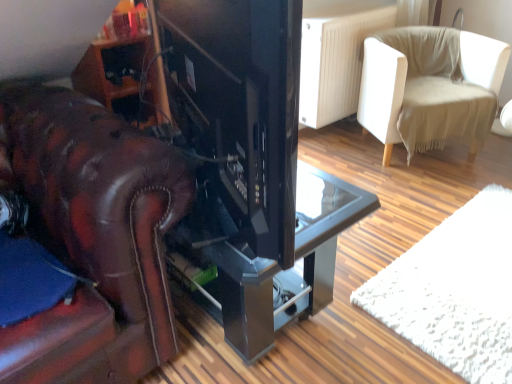
Question: Is matte black tv at center next to glossy black table at center?

Choices:
 (A) yes
 (B) no

Answer: (B)

Question: Can you confirm if matte black tv at center is shorter than glossy black table at center?

Choices:
 (A) no
 (B) yes

Answer: (A)

Question: Can you confirm if matte black tv at center is thinner than glossy black table at center?

Choices:
 (A) no
 (B) yes

Answer: (B)

Question: Is matte black tv at center far from glossy black table at center?

Choices:
 (A) yes
 (B) no

Answer: (B)

Question: From the image's perspective, is matte black tv at center located beneath glossy black table at center?

Choices:
 (A) yes
 (B) no

Answer: (B)

Question: From the image's perspective, is beige fabric chair at upper right located above or below glossy black table at center?

Choices:
 (A) below
 (B) above

Answer: (B)

Question: From a real-world perspective, is beige fabric chair at upper right physically located above or below glossy black table at center?

Choices:
 (A) below
 (B) above

Answer: (B)

Question: Is beige fabric chair at upper right taller or shorter than glossy black table at center?

Choices:
 (A) short
 (B) tall

Answer: (B)

Question: In the image, is beige fabric chair at upper right on the left side or the right side of glossy black table at center?

Choices:
 (A) right
 (B) left

Answer: (A)

Question: In the image, is matte black tv at center on the left side or the right side of glossy black table at center?

Choices:
 (A) left
 (B) right

Answer: (A)

Question: Is matte black tv at center wider or thinner than glossy black table at center?

Choices:
 (A) wide
 (B) thin

Answer: (B)

Question: From the image's perspective, is matte black tv at center located above or below glossy black table at center?

Choices:
 (A) below
 (B) above

Answer: (B)

Question: Would you say matte black tv at center is inside or outside glossy black table at center?

Choices:
 (A) inside
 (B) outside

Answer: (B)

Question: Choose the correct answer: Is glossy black table at center inside beige fabric chair at upper right or outside it?

Choices:
 (A) inside
 (B) outside

Answer: (B)

Question: From the image's perspective, is glossy black table at center located above or below beige fabric chair at upper right?

Choices:
 (A) below
 (B) above

Answer: (A)